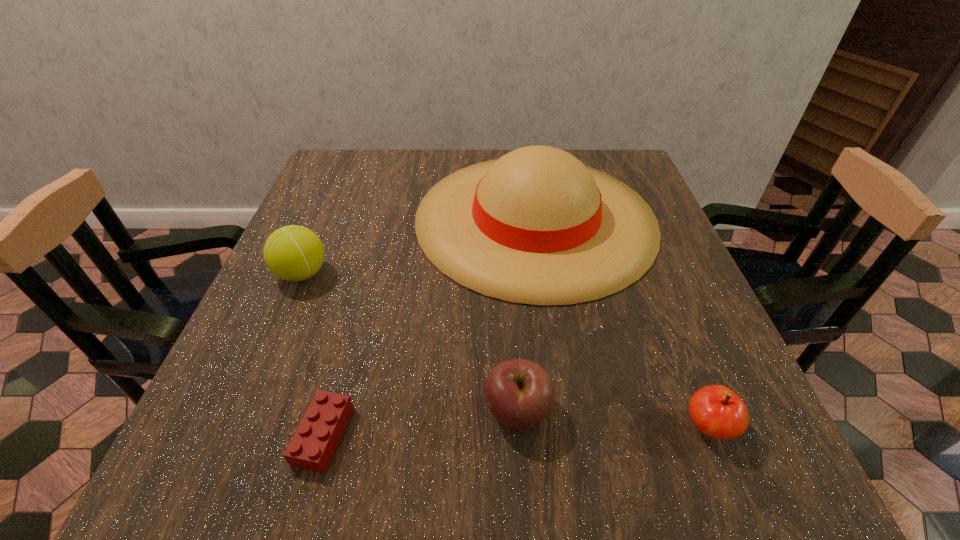
Locate an element on the screen. This screenshot has height=540, width=960. free location located on the side of the left apple with the unique marking is located at coordinates (265, 411).

Where is `vacant region located on the side of the left apple with the unique marking`? vacant region located on the side of the left apple with the unique marking is located at coordinates (284, 411).

The width and height of the screenshot is (960, 540). Identify the location of vacant region located on the back of the right apple. (672, 335).

Where is `free space located 0.060m on the back of the second object from left to right`? The height and width of the screenshot is (540, 960). free space located 0.060m on the back of the second object from left to right is located at coordinates (341, 370).

Locate an element on the screen. object situated at the far edge is located at coordinates (536, 226).

Locate an element on the screen. This screenshot has width=960, height=540. Lego that is positioned at the near edge is located at coordinates (311, 448).

The height and width of the screenshot is (540, 960). I want to click on tennis ball at the left edge, so click(x=294, y=253).

I want to click on Lego positioned at the left edge, so click(311, 448).

Locate an element on the screen. The width and height of the screenshot is (960, 540). sombrero located in the right edge section of the desktop is located at coordinates (536, 226).

At what (x,y) coordinates should I click in order to perform the action: click on apple at the right edge. Please return your answer as a coordinate pair (x, y). Looking at the image, I should click on (718, 412).